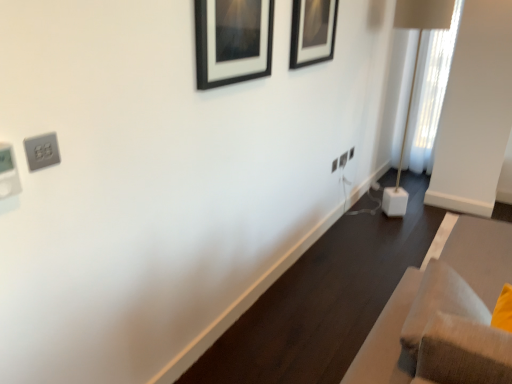
This screenshot has width=512, height=384. What do you see at coordinates (42, 151) in the screenshot?
I see `satin silver outlet at upper left, placed as the 1th electric outlet when sorted from left to right` at bounding box center [42, 151].

Image resolution: width=512 pixels, height=384 pixels. I want to click on white plastic electric outlet at center-right, placed as the second electric outlet when sorted from left to right, so click(x=343, y=159).

You are a GUI agent. You are given a task and a screenshot of the screen. Output one action in this format:
    pyautogui.click(x=<x>, y=<y>)
    Task: Click on the black matte picture frame at upper center, the second picture frame in the left-to-right sequence
    This screenshot has height=384, width=512.
    Given the screenshot: What is the action you would take?
    pyautogui.click(x=312, y=32)

Where is `white plastic electric outlet at center-right, the first electric outlet when ordered from top to bottom`? The width and height of the screenshot is (512, 384). white plastic electric outlet at center-right, the first electric outlet when ordered from top to bottom is located at coordinates (351, 153).

Locate an element on the screen. The image size is (512, 384). satin silver outlet at upper left, placed as the 1th electric outlet when sorted from left to right is located at coordinates (42, 151).

Is velvet beige sofa at lower right in front of or behind white plastic electric outlet at center-right, marked as the second electric outlet in a right-to-left arrangement, in the image?

velvet beige sofa at lower right is positioned closer to the viewer than white plastic electric outlet at center-right, marked as the second electric outlet in a right-to-left arrangement.

Who is smaller, velvet beige sofa at lower right or white plastic electric outlet at center-right, which is the second electric outlet in top-to-bottom order?

Smaller between the two is white plastic electric outlet at center-right, which is the second electric outlet in top-to-bottom order.

How different are the orientations of velvet beige sofa at lower right and white plastic electric outlet at center-right, placed as the second electric outlet when sorted from left to right, in degrees?

velvet beige sofa at lower right and white plastic electric outlet at center-right, placed as the second electric outlet when sorted from left to right, are facing 1.69 degrees away from each other.

How distant is velvet beige sofa at lower right from white plastic electric outlet at center-right, placed as the second electric outlet when sorted from left to right?

The distance of velvet beige sofa at lower right from white plastic electric outlet at center-right, placed as the second electric outlet when sorted from left to right, is 1.98 meters.

In the scene shown: Is black matte picture frame at upper center, which is counted as the second picture frame, starting from the right, at the back of black matte picture frame at upper center, placed as the first picture frame when sorted from right to left?

No, black matte picture frame at upper center, placed as the first picture frame when sorted from right to left,'s orientation is not away from black matte picture frame at upper center, which is counted as the second picture frame, starting from the right.

Based on the photo, can you tell me how much black matte picture frame at upper center, acting as the second picture frame starting from the front, and black matte picture frame at upper center, which appears as the 2th picture frame when viewed from the back, differ in facing direction?

1.11 degrees.

Is the surface of black matte picture frame at upper center, the second picture frame in the left-to-right sequence, in direct contact with black matte picture frame at upper center, which is counted as the second picture frame, starting from the right?

No, black matte picture frame at upper center, the second picture frame in the left-to-right sequence, is not touching black matte picture frame at upper center, which is counted as the second picture frame, starting from the right.

Is the depth of black matte picture frame at upper center, the second picture frame in the left-to-right sequence, less than that of black matte picture frame at upper center, which is counted as the second picture frame, starting from the right?

No, it is behind black matte picture frame at upper center, which is counted as the second picture frame, starting from the right.

Is white plastic electric outlet at center-right, which is the second electric outlet in top-to-bottom order, bigger than white sheer curtain at right?

No.

From a real-world perspective, which is physically above, white plastic electric outlet at center-right, marked as the second electric outlet in a right-to-left arrangement, or white sheer curtain at right?

In real-world perspective, white sheer curtain at right is above.

Find the location of a particular element. This screenshot has height=384, width=512. curtain behind the white plastic electric outlet at center-right, which is the second electric outlet from bottom to top is located at coordinates (431, 95).

Can you tell me how much white plastic electric outlet at center-right, which is the second electric outlet in front-to-back order, and white sheer curtain at right differ in facing direction?

87.1 degrees.

From the image's perspective, does white plastic electric outlet at center-right, positioned as the 3th electric outlet in left-to-right order, appear lower than black matte picture frame at upper center, which is the first picture frame in back-to-front order?

Yes, from the image's perspective, white plastic electric outlet at center-right, positioned as the 3th electric outlet in left-to-right order, is beneath black matte picture frame at upper center, which is the first picture frame in back-to-front order.

Does white plastic electric outlet at center-right, the first electric outlet positioned from the back, turn towards black matte picture frame at upper center, the second picture frame in the left-to-right sequence?

No, white plastic electric outlet at center-right, the first electric outlet positioned from the back, does not turn towards black matte picture frame at upper center, the second picture frame in the left-to-right sequence.

Considering the relative sizes of white plastic electric outlet at center-right, positioned as the 3th electric outlet in left-to-right order, and black matte picture frame at upper center, acting as the second picture frame starting from the front, in the image provided, is white plastic electric outlet at center-right, positioned as the 3th electric outlet in left-to-right order, taller than black matte picture frame at upper center, acting as the second picture frame starting from the front,?

No, white plastic electric outlet at center-right, positioned as the 3th electric outlet in left-to-right order, is not taller than black matte picture frame at upper center, acting as the second picture frame starting from the front.

Between white plastic electric outlet at center-right, which is the first electric outlet from right to left, and black matte picture frame at upper center, placed as the first picture frame when sorted from right to left, which one has smaller width?

white plastic electric outlet at center-right, which is the first electric outlet from right to left, is thinner.

How many degrees apart are the facing directions of white cube base at right and black matte picture frame at upper center, positioned as the first picture frame in front-to-back order?

0.711 degrees.

Between white cube base at right and black matte picture frame at upper center, positioned as the first picture frame in front-to-back order, which one has larger size?

white cube base at right is bigger.

From a real-world perspective, between white cube base at right and black matte picture frame at upper center, positioned as the first picture frame in front-to-back order, who is vertically higher?

In real-world perspective, black matte picture frame at upper center, positioned as the first picture frame in front-to-back order, is above.

Is white cube base at right next to black matte picture frame at upper center, which appears as the 2th picture frame when viewed from the back?

white cube base at right and black matte picture frame at upper center, which appears as the 2th picture frame when viewed from the back, are not in contact.

Which of these two, satin silver outlet at upper left, the third electric outlet in the back-to-front sequence, or velvet beige sofa at lower right, stands shorter?

Standing shorter between the two is satin silver outlet at upper left, the third electric outlet in the back-to-front sequence.

Could you tell me if satin silver outlet at upper left, placed as the 1th electric outlet when sorted from left to right, is facing velvet beige sofa at lower right?

No, satin silver outlet at upper left, placed as the 1th electric outlet when sorted from left to right, is not oriented towards velvet beige sofa at lower right.

Considering the relative positions of satin silver outlet at upper left, the third electric outlet in the back-to-front sequence, and velvet beige sofa at lower right in the image provided, is satin silver outlet at upper left, the third electric outlet in the back-to-front sequence, behind velvet beige sofa at lower right?

Yes, satin silver outlet at upper left, the third electric outlet in the back-to-front sequence, is further from the viewer.

From the picture: Does satin silver outlet at upper left, which is the first electric outlet in front-to-back order, have a lesser width compared to velvet beige sofa at lower right?

Indeed, satin silver outlet at upper left, which is the first electric outlet in front-to-back order, has a lesser width compared to velvet beige sofa at lower right.

Can you confirm if velvet beige sofa at lower right is positioned to the left of satin silver outlet at upper left, the first electric outlet ordered from the bottom?

No, velvet beige sofa at lower right is not to the left of satin silver outlet at upper left, the first electric outlet ordered from the bottom.

How distant is velvet beige sofa at lower right from satin silver outlet at upper left, the first electric outlet ordered from the bottom?

They are 1.12 meters apart.

Does velvet beige sofa at lower right have a lesser height compared to satin silver outlet at upper left, the 3th electric outlet positioned from the right?

No.

Would you say velvet beige sofa at lower right is inside or outside satin silver outlet at upper left, placed as the 1th electric outlet when sorted from left to right?

The correct answer is: outside.

In order to click on furniture above the white plastic electric outlet at center-right, which is the second electric outlet in front-to-back order (from a real-world perspective) in this screenshot , I will do `click(384, 342)`.

Where is `picture frame below the black matte picture frame at upper center, placed as the first picture frame when sorted from right to left (from a real-world perspective)`? picture frame below the black matte picture frame at upper center, placed as the first picture frame when sorted from right to left (from a real-world perspective) is located at coordinates (232, 41).

Which object lies further to the anchor point white plastic electric outlet at center-right, which is the second electric outlet from back to front, satin silver outlet at upper left, the 3th electric outlet when ordered from top to bottom, or black matte picture frame at upper center, placed as the first picture frame when sorted from right to left?

Among the two, satin silver outlet at upper left, the 3th electric outlet when ordered from top to bottom, is located further to white plastic electric outlet at center-right, which is the second electric outlet from back to front.

Which object lies further to the anchor point black matte picture frame at upper center, which is the first picture frame in back-to-front order, satin silver outlet at upper left, the first electric outlet ordered from the bottom, or velvet beige sofa at lower right?

satin silver outlet at upper left, the first electric outlet ordered from the bottom, is positioned further to the anchor black matte picture frame at upper center, which is the first picture frame in back-to-front order.

Based on their spatial positions, is white sheer curtain at right or white plastic electric outlet at center-right, which appears as the third electric outlet when ordered from the bottom, further from velvet beige sofa at lower right?

white sheer curtain at right is positioned further to the anchor velvet beige sofa at lower right.

From the picture: When comparing their distances from satin silver outlet at upper left, which is the first electric outlet in front-to-back order, does black matte picture frame at upper center, placed as the first picture frame when sorted from right to left, or black matte picture frame at upper center, which is counted as the second picture frame, starting from the right, seem closer?

Based on the image, black matte picture frame at upper center, which is counted as the second picture frame, starting from the right, appears to be nearer to satin silver outlet at upper left, which is the first electric outlet in front-to-back order.

From the image, which object appears to be nearer to white plastic electric outlet at center-right, the first electric outlet positioned from the back, black matte picture frame at upper center, placed as the first picture frame when sorted from right to left, or satin silver outlet at upper left, the first electric outlet ordered from the bottom?

Based on the image, black matte picture frame at upper center, placed as the first picture frame when sorted from right to left, appears to be nearer to white plastic electric outlet at center-right, the first electric outlet positioned from the back.

Based on their spatial positions, is black matte picture frame at upper center, the second picture frame in the left-to-right sequence, or white cube base at right closer to velvet beige sofa at lower right?

Among the two, black matte picture frame at upper center, the second picture frame in the left-to-right sequence, is located nearer to velvet beige sofa at lower right.

Estimate the real-world distances between objects in this image. Which object is further from white plastic electric outlet at center-right, which is the first electric outlet from right to left, white plastic electric outlet at center-right, which is the second electric outlet from bottom to top, or satin silver outlet at upper left, the third electric outlet in the back-to-front sequence?

Among the two, satin silver outlet at upper left, the third electric outlet in the back-to-front sequence, is located further to white plastic electric outlet at center-right, which is the first electric outlet from right to left.

Based on their spatial positions, is white plastic electric outlet at center-right, marked as the second electric outlet in a right-to-left arrangement, or white plastic electric outlet at center-right, the first electric outlet positioned from the back, further from black matte picture frame at upper center, which is counted as the second picture frame, starting from the right?

Among the two, white plastic electric outlet at center-right, the first electric outlet positioned from the back, is located further to black matte picture frame at upper center, which is counted as the second picture frame, starting from the right.

This screenshot has width=512, height=384. I want to click on table lamp positioned between satin silver outlet at upper left, the first electric outlet ordered from the bottom, and white plastic electric outlet at center-right, which is the second electric outlet in front-to-back order, from near to far, so click(414, 75).

I want to click on table lamp between black matte picture frame at upper center, placed as the first picture frame when sorted from right to left, and white plastic electric outlet at center-right, which is the second electric outlet in top-to-bottom order, along the z-axis, so click(414, 75).

Where is `table lamp located between black matte picture frame at upper center, acting as the second picture frame starting from the front, and white plastic electric outlet at center-right, acting as the 3th electric outlet starting from the front, in the depth direction`? The image size is (512, 384). table lamp located between black matte picture frame at upper center, acting as the second picture frame starting from the front, and white plastic electric outlet at center-right, acting as the 3th electric outlet starting from the front, in the depth direction is located at coordinates (414, 75).

You are a GUI agent. You are given a task and a screenshot of the screen. Output one action in this format:
    pyautogui.click(x=<x>, y=<y>)
    Task: Click on the picture frame between black matte picture frame at upper center, which is counted as the second picture frame, starting from the right, and white plastic electric outlet at center-right, the first electric outlet when ordered from top to bottom, along the z-axis
    
    Given the screenshot: What is the action you would take?
    pyautogui.click(x=312, y=32)